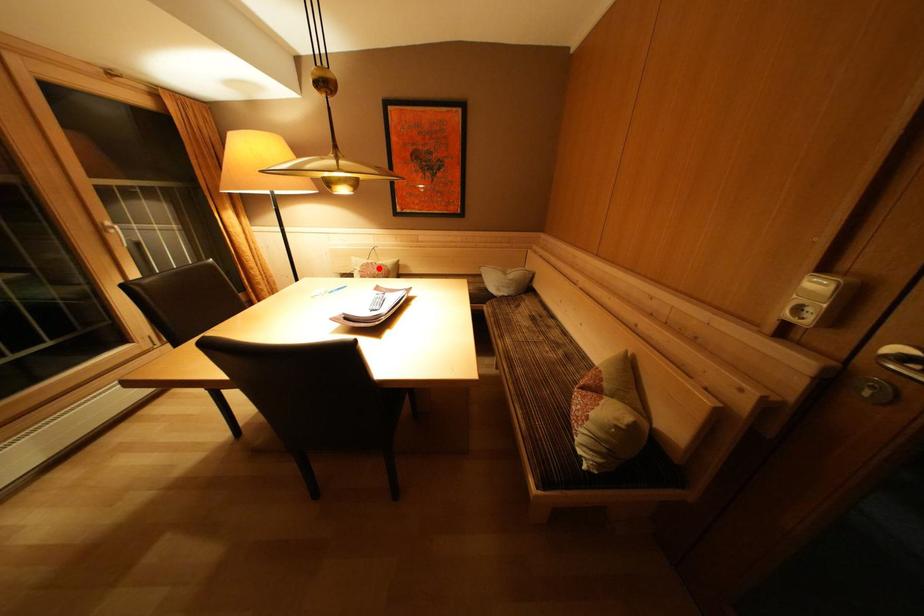
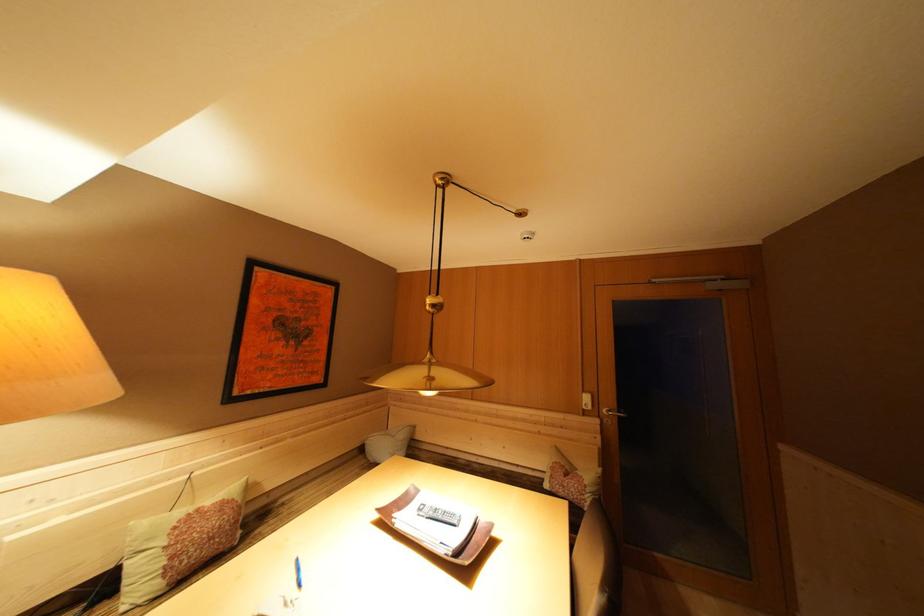
Where in the second image is the point corresponding to the highlighted location from the first image?

(204, 515)